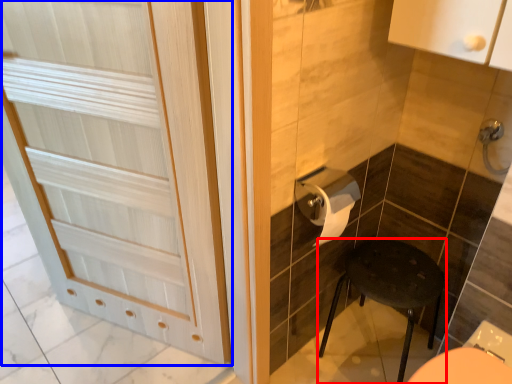
Question: Which point is closer to the camera, furniture (highlighted by a red box) or door (highlighted by a blue box)?

Choices:
 (A) furniture
 (B) door

Answer: (B)